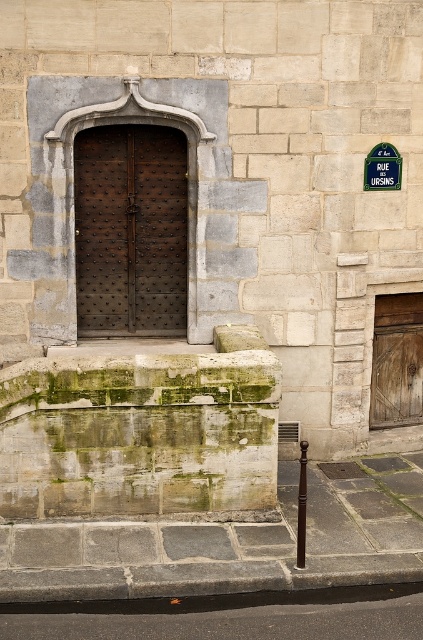
Can you confirm if dark brown wooden door at center is positioned to the right of green plastic sign at upper right?

No, dark brown wooden door at center is not to the right of green plastic sign at upper right.

Looking at this image, which is more to the left, dark brown wooden door at center or green plastic sign at upper right?

From the viewer's perspective, dark brown wooden door at center appears more on the left side.

Measure the distance between point (145,292) and camera.

They are 8.65 meters apart.

Find the location of a particular element. The height and width of the screenshot is (640, 423). dark brown wooden door at center is located at coordinates (131, 230).